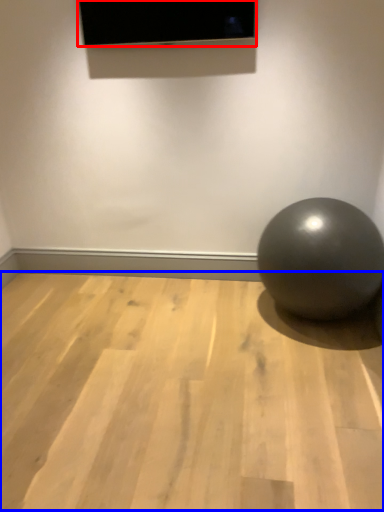
Question: Which point is further to the camera, projection screen (highlighted by a red box) or surface (highlighted by a blue box)?

Choices:
 (A) projection screen
 (B) surface

Answer: (A)